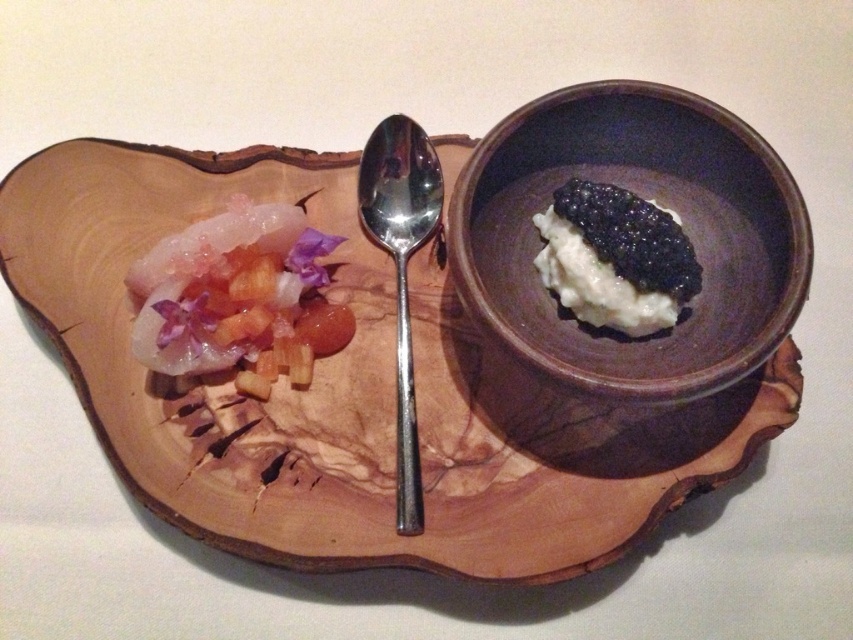
Question: Which point is closer to the camera taking this photo?

Choices:
 (A) (563, 230)
 (B) (438, 548)

Answer: (B)

Question: Does wooden platter at center appear under black glossy caviar at center?

Choices:
 (A) no
 (B) yes

Answer: (B)

Question: Where is black glossy caviar at center located in relation to polished silver spoon at center in the image?

Choices:
 (A) right
 (B) left

Answer: (A)

Question: Which of the following is the farthest from the observer?

Choices:
 (A) black glossy caviar at center
 (B) wooden platter at center
 (C) brown matte bowl at center

Answer: (A)

Question: Is wooden platter at center to the right of translucent gelatinous at left from the viewer's perspective?

Choices:
 (A) yes
 (B) no

Answer: (A)

Question: Which object appears closest to the camera in this image?

Choices:
 (A) translucent gelatinous at left
 (B) wooden platter at center

Answer: (B)